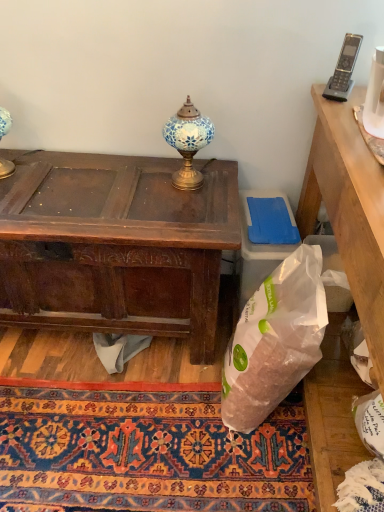
Question: Considering the relative sizes of carpet with intricate patterns at lower center and gray plastic phone at upper right in the image provided, is carpet with intricate patterns at lower center taller than gray plastic phone at upper right?

Choices:
 (A) no
 (B) yes

Answer: (A)

Question: Is carpet with intricate patterns at lower center positioned far away from gray plastic phone at upper right?

Choices:
 (A) no
 (B) yes

Answer: (B)

Question: Does carpet with intricate patterns at lower center appear on the right side of gray plastic phone at upper right?

Choices:
 (A) no
 (B) yes

Answer: (A)

Question: Is gray plastic phone at upper right a part of carpet with intricate patterns at lower center?

Choices:
 (A) yes
 (B) no

Answer: (B)

Question: Are carpet with intricate patterns at lower center and gray plastic phone at upper right beside each other?

Choices:
 (A) no
 (B) yes

Answer: (A)

Question: Considering their positions, is white plastic trash bin/can at lower right located in front of or behind gray plastic phone at upper right?

Choices:
 (A) behind
 (B) front

Answer: (A)

Question: From the image's perspective, is white plastic trash bin/can at lower right above or below gray plastic phone at upper right?

Choices:
 (A) above
 (B) below

Answer: (B)

Question: Visually, is white plastic trash bin/can at lower right positioned to the left or to the right of gray plastic phone at upper right?

Choices:
 (A) left
 (B) right

Answer: (A)

Question: Considering the positions of white plastic trash bin/can at lower right and gray plastic phone at upper right in the image, is white plastic trash bin/can at lower right taller or shorter than gray plastic phone at upper right?

Choices:
 (A) tall
 (B) short

Answer: (A)

Question: From a real-world perspective, is translucent white plastic bag at lower right positioned above or below blue mosaic lamp at center?

Choices:
 (A) above
 (B) below

Answer: (B)

Question: Choose the correct answer: Is translucent white plastic bag at lower right inside blue mosaic lamp at center or outside it?

Choices:
 (A) outside
 (B) inside

Answer: (A)

Question: Is translucent white plastic bag at lower right to the left or to the right of blue mosaic lamp at center in the image?

Choices:
 (A) left
 (B) right

Answer: (B)

Question: Based on their sizes in the image, would you say translucent white plastic bag at lower right is bigger or smaller than blue mosaic lamp at center?

Choices:
 (A) big
 (B) small

Answer: (A)

Question: In terms of height, does white plastic trash bin/can at lower right look taller or shorter compared to carpet with intricate patterns at lower center?

Choices:
 (A) short
 (B) tall

Answer: (B)

Question: Based on their sizes in the image, would you say white plastic trash bin/can at lower right is bigger or smaller than carpet with intricate patterns at lower center?

Choices:
 (A) small
 (B) big

Answer: (A)